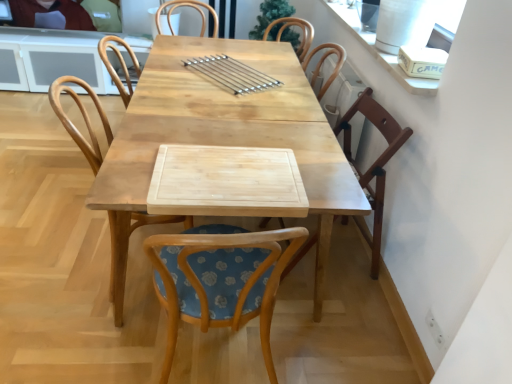
The image size is (512, 384). In order to click on vacant space to the left of natural wood table at center in this screenshot , I will do `click(45, 200)`.